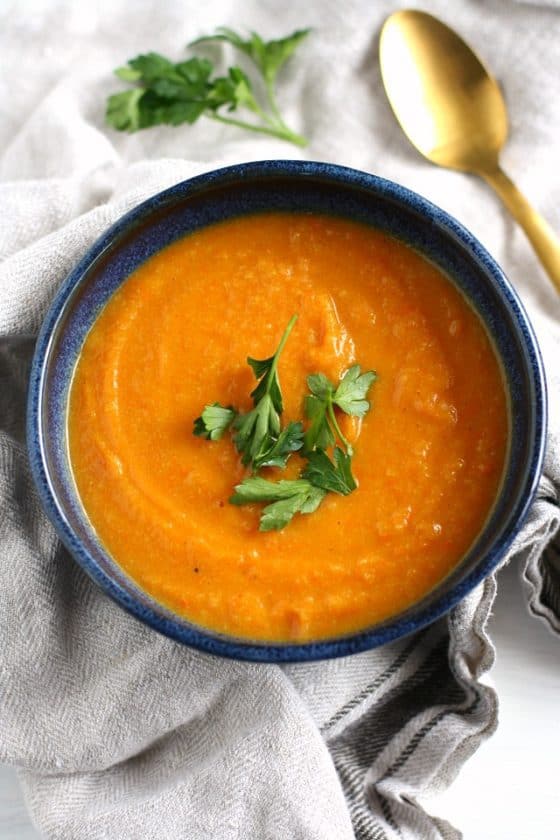
At what (x,y) coordinates should I click in order to perform the action: click on golden spoon handle. Please return your answer as a coordinate pair (x, y). The width and height of the screenshot is (560, 840). Looking at the image, I should click on (547, 247).